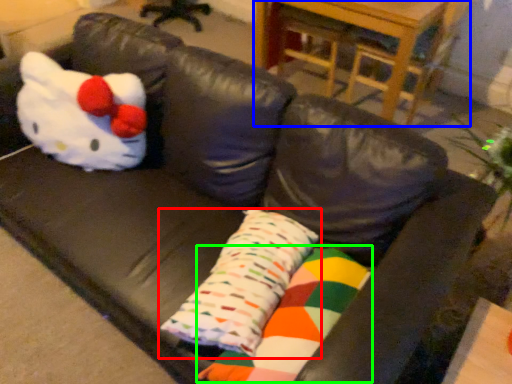
Question: Which object is positioned closest to pillow (highlighted by a red box)? Select from table (highlighted by a blue box) and material (highlighted by a green box).

Choices:
 (A) table
 (B) material

Answer: (B)